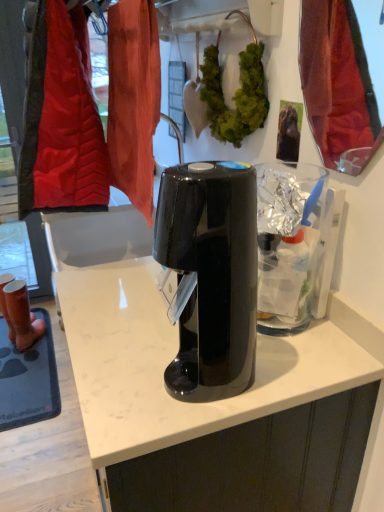
Locate an element on the screen. free spot in front of matte brown boots at left is located at coordinates (24, 357).